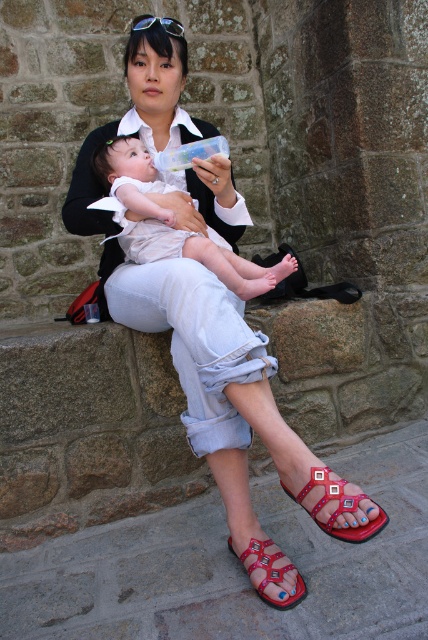
Which is behind, point (329, 480) or point (172, 26)?

The point (172, 26) is more distant.

Does red leather sandal at lower center have a lesser height compared to shiny black sunglasses at upper center?

In fact, red leather sandal at lower center may be taller than shiny black sunglasses at upper center.

You are a GUI agent. You are given a task and a screenshot of the screen. Output one action in this format:
    pyautogui.click(x=<x>, y=<y>)
    Task: Click on the red leather sandal at lower center
    
    Given the screenshot: What is the action you would take?
    pyautogui.click(x=338, y=506)

Who is positioned more to the right, matte black shirt at center or shiny black sunglasses at upper center?

Positioned to the right is matte black shirt at center.

What do you see at coordinates (210, 374) in the screenshot?
I see `matte black shirt at center` at bounding box center [210, 374].

Image resolution: width=428 pixels, height=640 pixels. I want to click on matte black shirt at center, so click(x=210, y=374).

Can you confirm if white cotton baby at center is shorter than red leather sandal at lower right?

No.

Does white cotton baby at center appear on the left side of red leather sandal at lower right?

Correct, you'll find white cotton baby at center to the left of red leather sandal at lower right.

Between point (124, 156) and point (256, 557), which one is positioned behind?

The point (124, 156) is more distant.

Locate an element on the screen. This screenshot has height=640, width=428. white cotton baby at center is located at coordinates (169, 221).